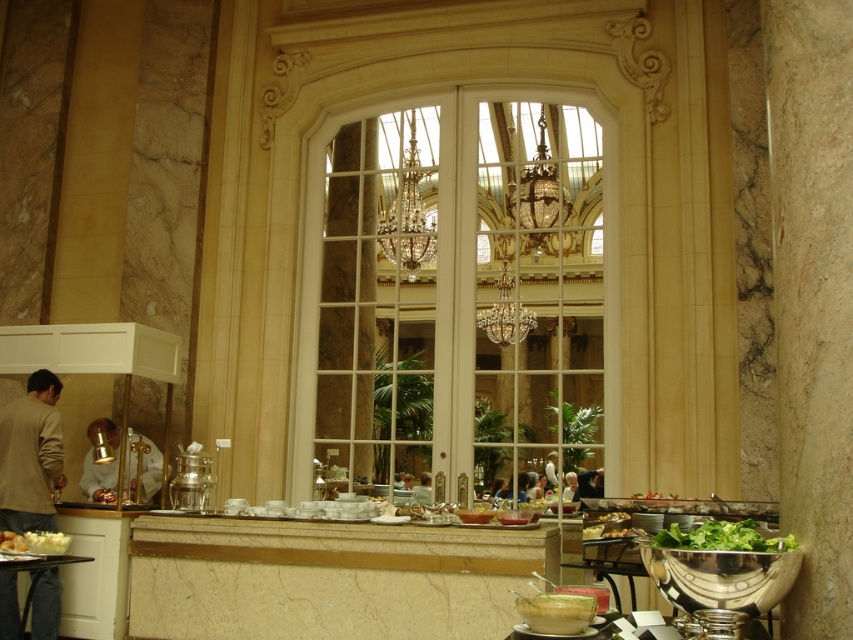
Question: Estimate the real-world distances between objects in this image. Which object is closer to the green leafy salad at lower right?

Choices:
 (A) light brown jacket at lower left
 (B) gold metallic lamp at center
 (C) light brown leather jacket at center
 (D) clear glass window at center

Answer: (C)

Question: Among these points, which one is farthest from the camera?

Choices:
 (A) (117, 500)
 (B) (351, 196)
 (C) (44, 548)

Answer: (B)

Question: Is translucent glass bowl at lower center wider than light brown leather jacket at center?

Choices:
 (A) yes
 (B) no

Answer: (A)

Question: Which of these objects is positioned closest to the green leafy salad at lower right?

Choices:
 (A) wooden table at lower left
 (B) white crumbly bread at lower left
 (C) gold metallic lamp at center

Answer: (B)

Question: Can you confirm if white creamy mashed potatoes at lower left is bigger than light brown leather jacket at center?

Choices:
 (A) no
 (B) yes

Answer: (A)

Question: Is white crumbly bread at lower left to the left of green leafy salad at lower center from the viewer's perspective?

Choices:
 (A) yes
 (B) no

Answer: (A)